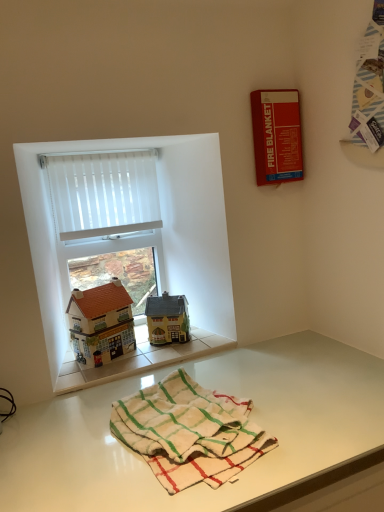
The image size is (384, 512). Find the location of `vacant space situated on the left part of matte yellow house at center, which ranks as the first toy in right-to-left order`. vacant space situated on the left part of matte yellow house at center, which ranks as the first toy in right-to-left order is located at coordinates pyautogui.click(x=134, y=349).